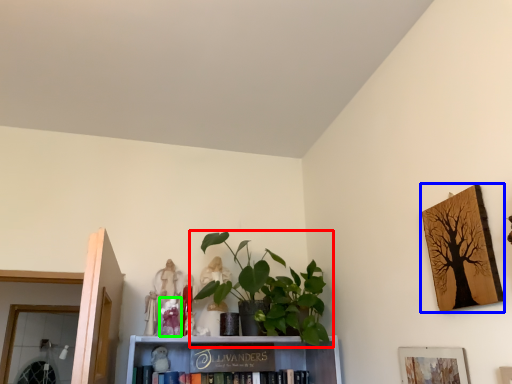
Question: Considering the real-world distances, which object is farthest from houseplant (highlighted by a red box)? picture frame (highlighted by a blue box) or toy (highlighted by a green box)?

Choices:
 (A) picture frame
 (B) toy

Answer: (A)